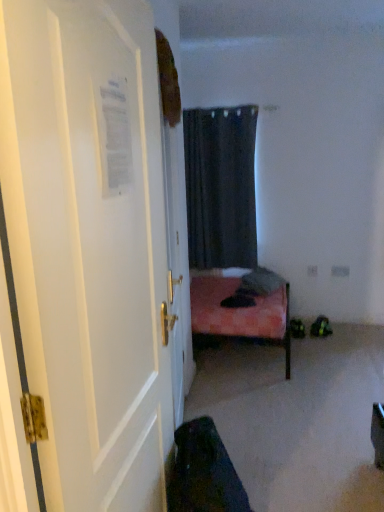
Question: From a real-world perspective, is dark matte curtain at center above or below white glossy door at left?

Choices:
 (A) above
 (B) below

Answer: (A)

Question: Visually, is dark matte curtain at center positioned to the left or to the right of white glossy door at left?

Choices:
 (A) left
 (B) right

Answer: (B)

Question: From the image's perspective, relative to white glossy door at left, is dark matte curtain at center above or below?

Choices:
 (A) above
 (B) below

Answer: (A)

Question: Considering their positions, is white glossy door at left located in front of or behind dark matte curtain at center?

Choices:
 (A) front
 (B) behind

Answer: (A)

Question: Is white glossy door at left taller or shorter than dark matte curtain at center?

Choices:
 (A) short
 (B) tall

Answer: (B)

Question: Considering the positions of white glossy door at left and dark matte curtain at center in the image, is white glossy door at left wider or thinner than dark matte curtain at center?

Choices:
 (A) wide
 (B) thin

Answer: (B)

Question: Visually, is white glossy door at left positioned to the left or to the right of dark matte curtain at center?

Choices:
 (A) right
 (B) left

Answer: (B)